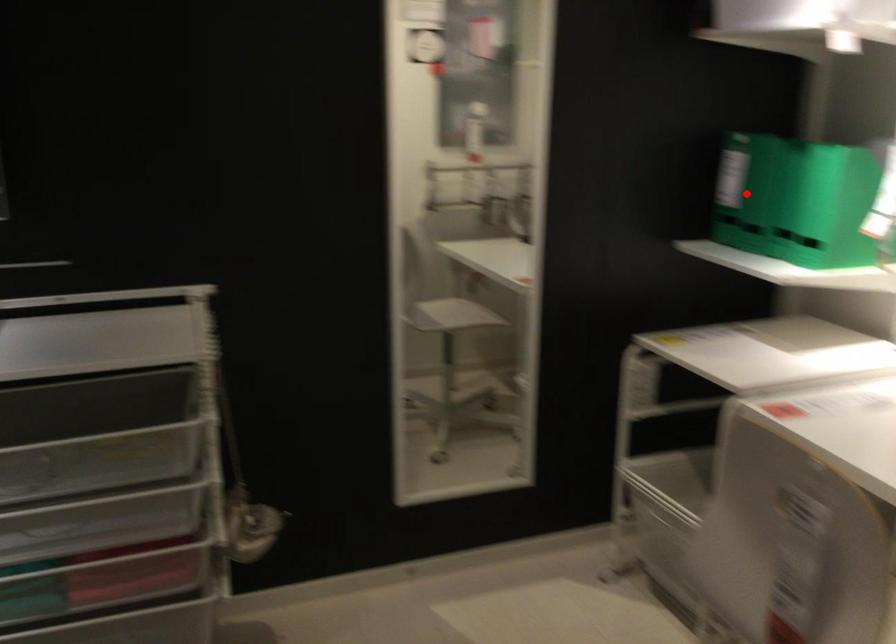
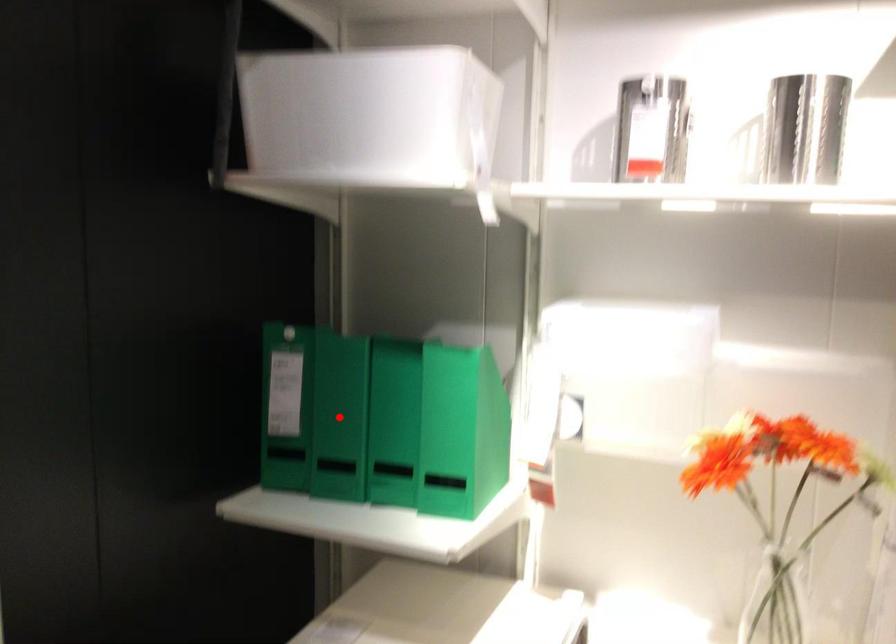
I am providing you with two images of the same scene from different viewpoints. A red point is marked on the first image and another point is marked on the second image. Do the highlighted points in image1 and image2 indicate the same real-world spot?

Yes